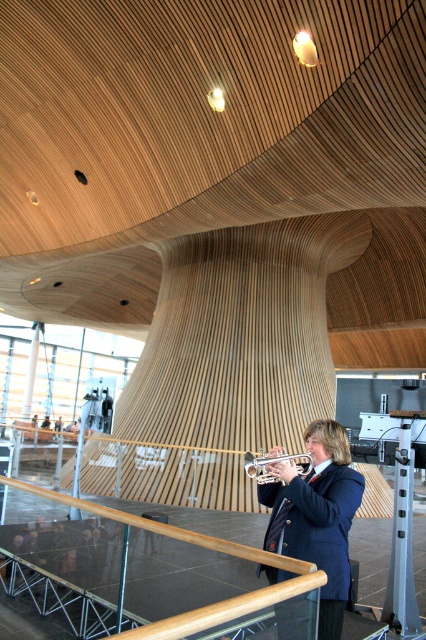
Which is in front, point (299, 480) or point (51, 493)?

Point (299, 480)

Does shiny blue blazer at center have a greater height compared to wooden polished rail at center?

Indeed, shiny blue blazer at center has a greater height compared to wooden polished rail at center.

Who is more forward, (331, 445) or (247, 596)?

Positioned in front is point (247, 596).

Find the location of `shiny blue blazer at center`. shiny blue blazer at center is located at coordinates (316, 515).

Between shiny blue blazer at center and silver metallic trumpet at center, which one is positioned higher?

Positioned higher is silver metallic trumpet at center.

Can you confirm if shiny blue blazer at center is smaller than silver metallic trumpet at center?

Actually, shiny blue blazer at center might be larger than silver metallic trumpet at center.

Which is in front, point (317, 435) or point (302, 474)?

Positioned in front is point (302, 474).

You are a GUI agent. You are given a task and a screenshot of the screen. Output one action in this format:
    pyautogui.click(x=<x>, y=<y>)
    Task: Click on the shiny blue blazer at center
    
    Given the screenshot: What is the action you would take?
    pyautogui.click(x=316, y=515)

Is wooden polished rail at center positioned before silver metallic trumpet at center?

Yes.

Locate an element on the screen. Image resolution: width=426 pixels, height=640 pixels. wooden polished rail at center is located at coordinates (203, 547).

Where is `wooden polished rail at center`? Image resolution: width=426 pixels, height=640 pixels. wooden polished rail at center is located at coordinates (203, 547).